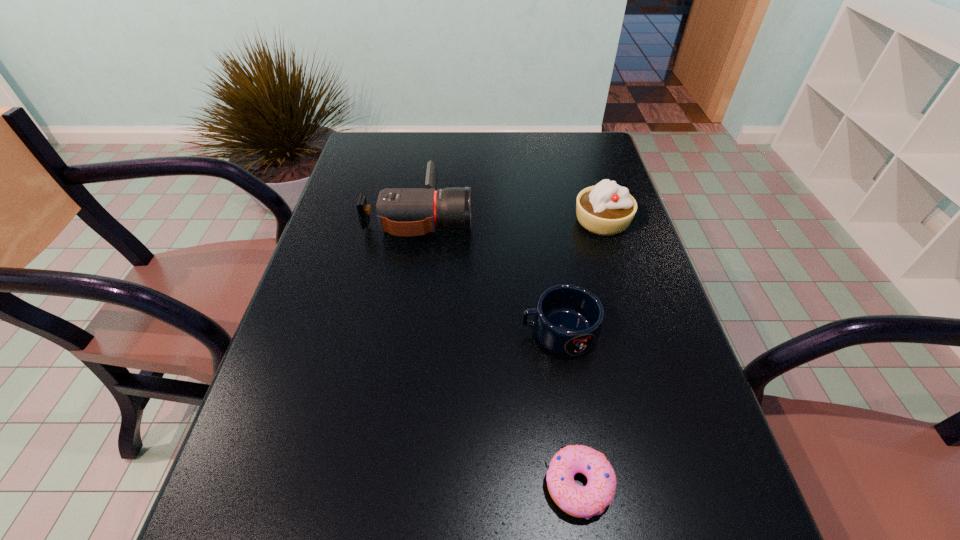
What are the coordinates of `object that is the closest one to the third tallest object` in the screenshot? It's located at (579, 501).

I want to click on vacant space that satisfies the following two spatial constraints: 1. on the back side of the whipped cream; 2. on the lens of the leftmost object, so click(600, 216).

What are the coordinates of `vacant space that satisfies the following two spatial constraints: 1. with the handle on the side of the mug; 2. on the front side of the doughnut` in the screenshot? It's located at (582, 484).

Find the location of `free spot that satisfies the following two spatial constraints: 1. on the back side of the doughnut; 2. on the right side of the whipped cream`. free spot that satisfies the following two spatial constraints: 1. on the back side of the doughnut; 2. on the right side of the whipped cream is located at coordinates (540, 221).

This screenshot has height=540, width=960. Find the location of `vacant area in the image that satisfies the following two spatial constraints: 1. on the front side of the whipped cream; 2. with the handle on the side of the third farthest object`. vacant area in the image that satisfies the following two spatial constraints: 1. on the front side of the whipped cream; 2. with the handle on the side of the third farthest object is located at coordinates pyautogui.click(x=636, y=332).

At what (x,y) coordinates should I click in order to perform the action: click on vacant space that satisfies the following two spatial constraints: 1. on the lens of the shortest object; 2. on the right side of the camcorder. Please return your answer as a coordinate pair (x, y). The image size is (960, 540). Looking at the image, I should click on (377, 484).

You are a GUI agent. You are given a task and a screenshot of the screen. Output one action in this format:
    pyautogui.click(x=<x>, y=<y>)
    Task: Click on the blank area in the image that satisfies the following two spatial constraints: 1. with the handle on the side of the third farthest object; 2. on the front side of the nearest object
    The width and height of the screenshot is (960, 540).
    Given the screenshot: What is the action you would take?
    pyautogui.click(x=582, y=484)